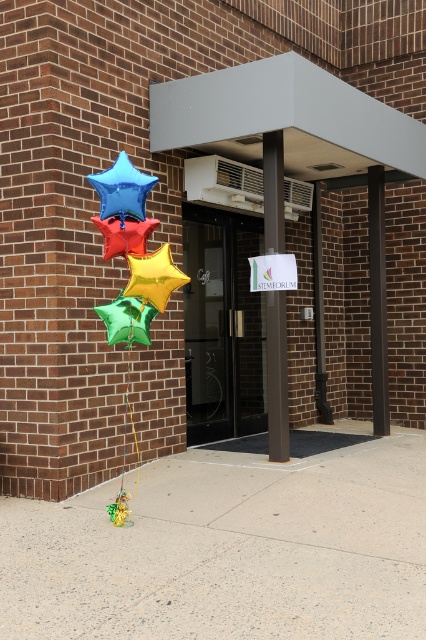
Based on the photo, you are standing at the entrance of the building and want to place a small potted plant between the concrete at center and the brown polished pillar at center. Based on their positions, where should you place the potted plant?

The concrete at center is below the brown polished pillar at center, so you should place the potted plant on the concrete at center between them.

You are standing at the entrance of the STEM FORUM building and see the blue metallic star at upper left and the metallic gold star at center. Which star is positioned more to the left side?

The blue metallic star at upper left is positioned more to the left side than the metallic gold star at center.

You are standing at the entrance of the building and see the brown polished pillar at center and the blue metallic star at upper left. Which object is located more to the left?

The blue metallic star at upper left is more to the left because the brown polished pillar at center is positioned on the right side of it.